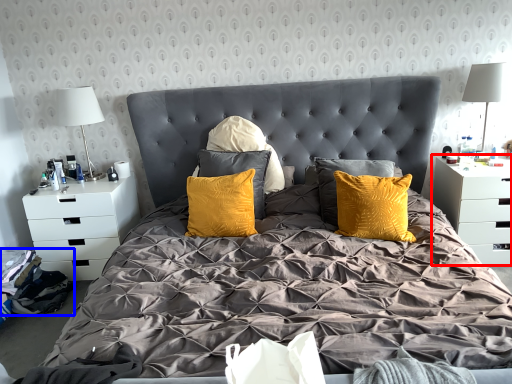
Question: Which object appears farthest to the camera in this image, nightstand (highlighted by a red box) or material (highlighted by a blue box)?

Choices:
 (A) nightstand
 (B) material

Answer: (A)